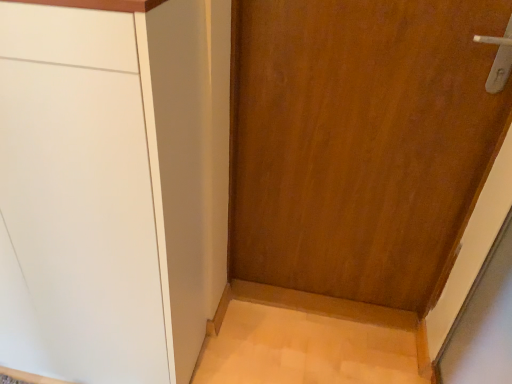
Identify the location of vacant area that lies in front of wooden door at center. This screenshot has width=512, height=384. (329, 344).